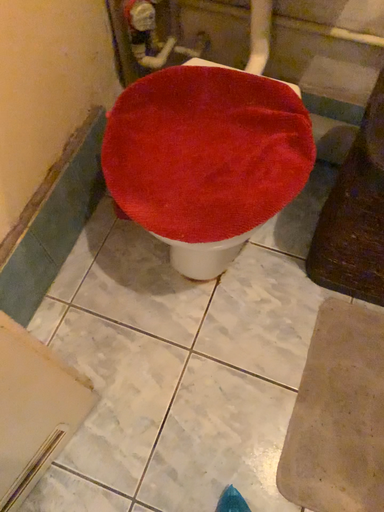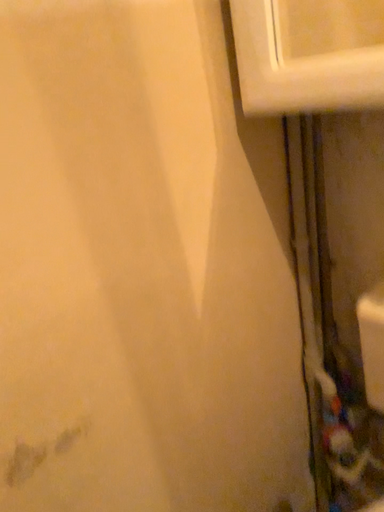
Question: How did the camera likely rotate when shooting the video?

Choices:
 (A) rotated left
 (B) rotated right

Answer: (A)